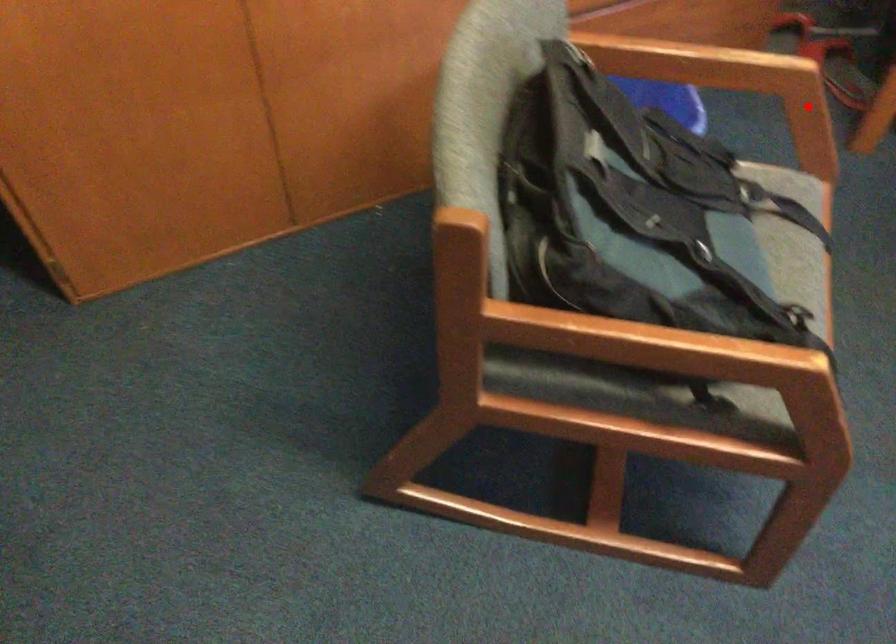
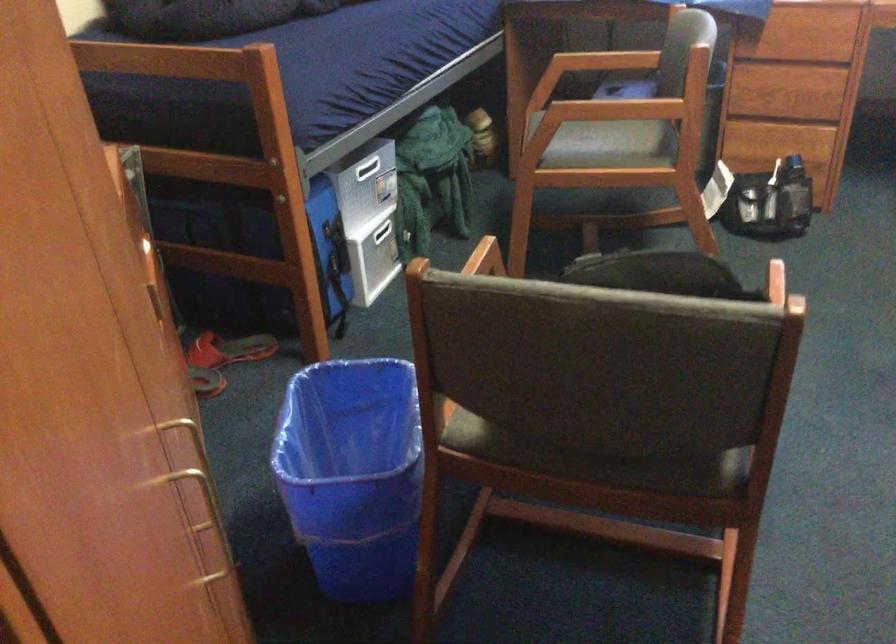
Question: A red point is marked in image1. In image2, is the corresponding 3D point closer to the camera or farther? Reply with the corresponding letter.

Choices:
 (A) The corresponding 3D point is closer.
 (B) The corresponding 3D point is farther.

Answer: (B)